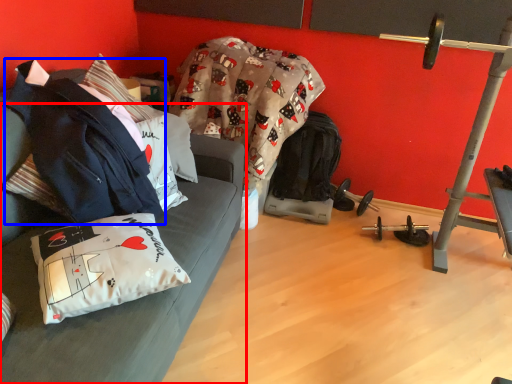
Question: Which object is closer to the camera taking this photo, studio couch (highlighted by a red box) or jacket (highlighted by a blue box)?

Choices:
 (A) studio couch
 (B) jacket

Answer: (A)